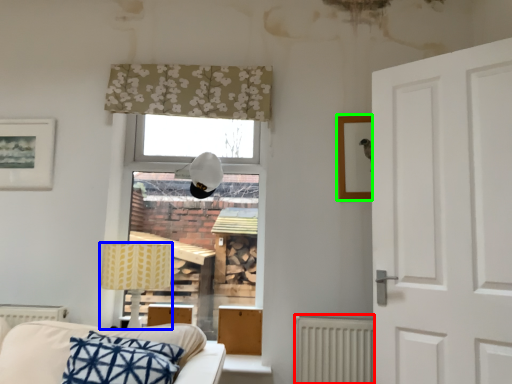
Question: Which is farther away from radiator (highlighted by a red box)? table lamp (highlighted by a blue box) or picture frame (highlighted by a green box)?

Choices:
 (A) table lamp
 (B) picture frame

Answer: (A)